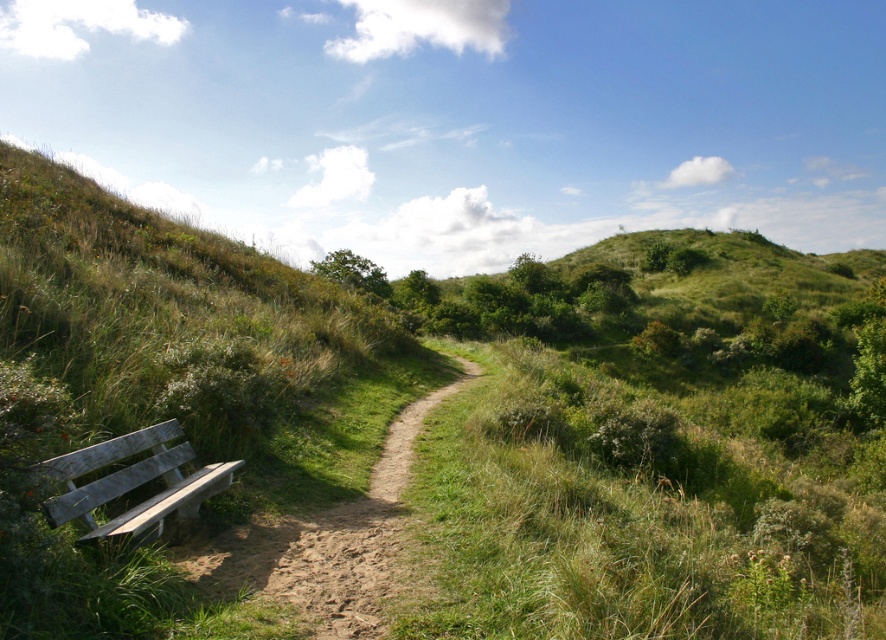
Question: Which point appears farthest from the camera in this image?

Choices:
 (A) (176, 433)
 (B) (313, 531)

Answer: (A)

Question: Which point appears closest to the camera in this image?

Choices:
 (A) (59, 524)
 (B) (307, 550)

Answer: (A)

Question: From the image, what is the correct spatial relationship of brown dirt path at center in relation to weathered wood bench at lower left?

Choices:
 (A) left
 (B) right

Answer: (B)

Question: Which of the following is the closest to the observer?

Choices:
 (A) brown dirt path at center
 (B) weathered wood bench at lower left

Answer: (A)

Question: Does brown dirt path at center appear on the left side of weathered wood bench at lower left?

Choices:
 (A) no
 (B) yes

Answer: (A)

Question: Observing the image, what is the correct spatial positioning of brown dirt path at center in reference to weathered wood bench at lower left?

Choices:
 (A) below
 (B) above

Answer: (A)